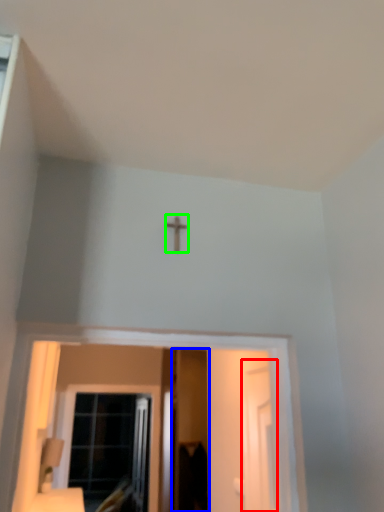
Question: Estimate the real-world distances between objects in this image. Which object is farther from screen door (highlighted by a red box), screen door (highlighted by a blue box) or crucifix (highlighted by a green box)?

Choices:
 (A) screen door
 (B) crucifix

Answer: (A)